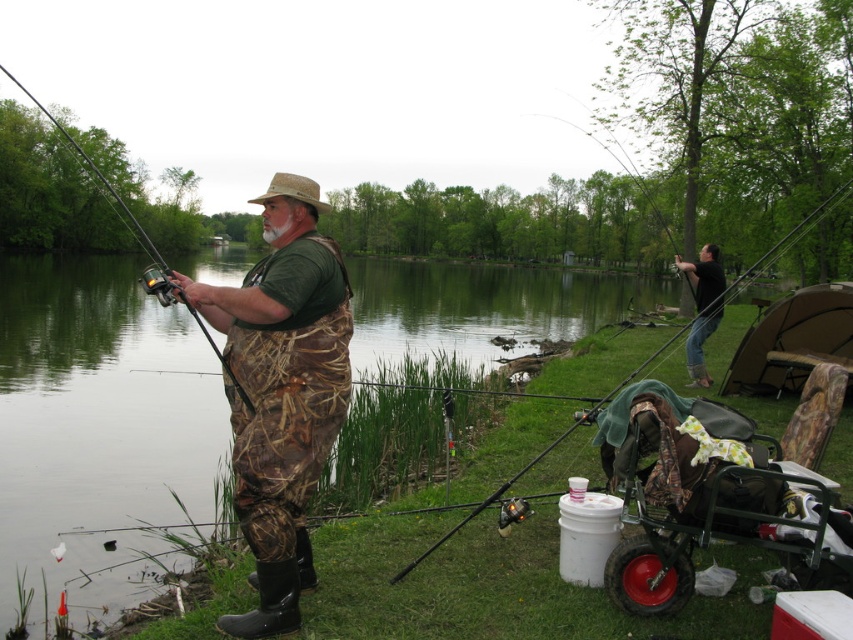
Question: Is matte black fishing pole at right smaller than dark green shirt at right?

Choices:
 (A) yes
 (B) no

Answer: (B)

Question: Is dark green shirt at right bigger than matte black fishing pole at left?

Choices:
 (A) yes
 (B) no

Answer: (B)

Question: Which point is closer to the camera?

Choices:
 (A) (688, 346)
 (B) (303, 256)

Answer: (B)

Question: Does camo fabric waders at center appear over dark green shirt at right?

Choices:
 (A) yes
 (B) no

Answer: (B)

Question: Which point appears farthest from the camera in this image?

Choices:
 (A) (563, 433)
 (B) (299, 307)
 (C) (701, 308)
 (D) (149, 250)

Answer: (D)

Question: Considering the real-world distances, which object is farthest from the dark green shirt at right?

Choices:
 (A) matte black fishing pole at left
 (B) matte black fishing pole at right

Answer: (A)